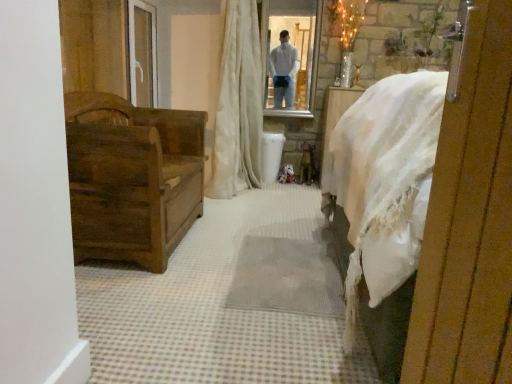
Question: Can you confirm if clear glass mirror at upper center is bigger than white textured curtain at center?

Choices:
 (A) no
 (B) yes

Answer: (A)

Question: From a real-world perspective, is clear glass mirror at upper center under white textured curtain at center?

Choices:
 (A) no
 (B) yes

Answer: (A)

Question: Is clear glass mirror at upper center wider than white textured curtain at center?

Choices:
 (A) no
 (B) yes

Answer: (A)

Question: Is clear glass mirror at upper center positioned in front of white textured curtain at center?

Choices:
 (A) yes
 (B) no

Answer: (B)

Question: Can you confirm if clear glass mirror at upper center is shorter than white textured curtain at center?

Choices:
 (A) yes
 (B) no

Answer: (A)

Question: Is clear glass mirror at upper center aimed at white textured curtain at center?

Choices:
 (A) yes
 (B) no

Answer: (B)

Question: Does white textured curtain at center come behind dark brown wood chest at left?

Choices:
 (A) no
 (B) yes

Answer: (B)

Question: From the image's perspective, would you say white textured curtain at center is positioned over dark brown wood chest at left?

Choices:
 (A) no
 (B) yes

Answer: (B)

Question: From a real-world perspective, is white textured curtain at center located higher than dark brown wood chest at left?

Choices:
 (A) yes
 (B) no

Answer: (A)

Question: From a real-world perspective, is white textured curtain at center physically below dark brown wood chest at left?

Choices:
 (A) yes
 (B) no

Answer: (B)

Question: Is white textured curtain at center positioned far away from dark brown wood chest at left?

Choices:
 (A) no
 (B) yes

Answer: (A)

Question: Is white textured curtain at center touching dark brown wood chest at left?

Choices:
 (A) no
 (B) yes

Answer: (A)

Question: From the image's perspective, is wooden chest at left located above white textured curtain at center?

Choices:
 (A) yes
 (B) no

Answer: (B)